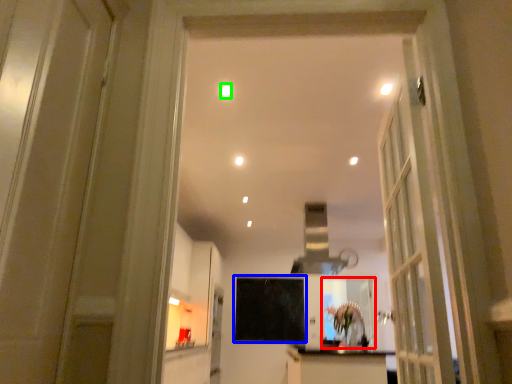
Question: Which object is the farthest from mirror (highlighted by a red box)? Choose among these: screen door (highlighted by a blue box) or lighting (highlighted by a green box).

Choices:
 (A) screen door
 (B) lighting

Answer: (B)